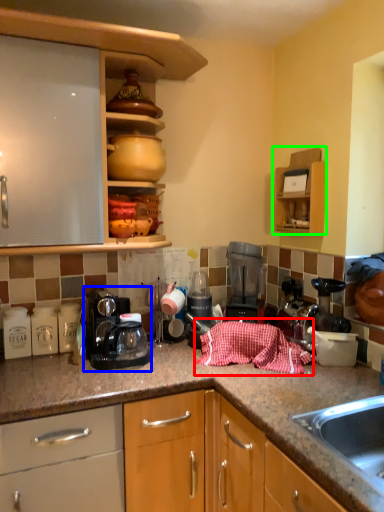
Question: Based on their relative distances, which object is farther from blanket (highlighted by a red box)? Choose from home appliance (highlighted by a blue box) and cabinetry (highlighted by a green box).

Choices:
 (A) home appliance
 (B) cabinetry

Answer: (B)